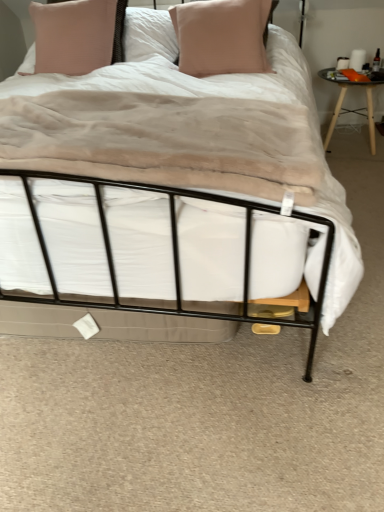
You are a GUI agent. You are given a task and a screenshot of the screen. Output one action in this format:
    pyautogui.click(x=<x>, y=<y>)
    Task: Click on the vacant space in front of black glass table at right
    
    Given the screenshot: What is the action you would take?
    pyautogui.click(x=354, y=170)